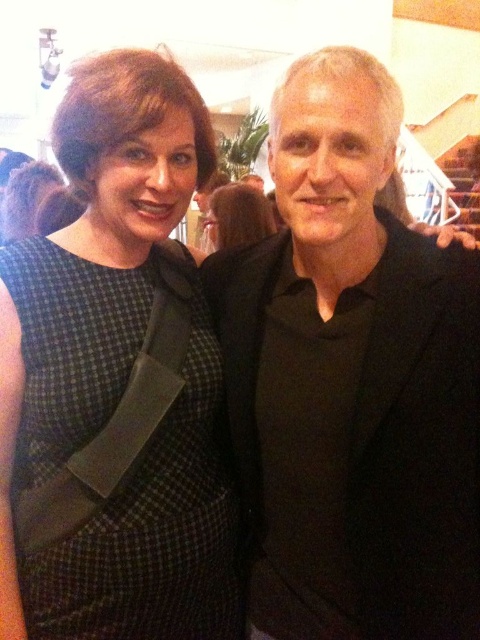
You are at a social event and see two people standing near a staircase. The woman in the green checkered dress at left and the man with dark brown hair at center are both smiling. Which person is standing more to the left?

The green checkered dress at left is positioned on the left side of dark brown hair at center, so the woman in the green checkered dress at left is standing more to the left.

You are planning to take a photo of the black matte suit at center and the green checkered dress at left. Which one should you zoom in on to capture more details without moving the camera?

The black matte suit at center is larger in size than the green checkered dress at left, so you should zoom in on the black matte suit at center to capture more details without moving the camera since it occupies a bigger area in the frame.

You are a photographer at a social event. You need to capture a photo of the black matte suit at center and dark brown hair at center. Which object should you focus on first if you want to ensure both are in focus, given that focusing on the closer object first is better? Please explain your reasoning based on their positions.

The black matte suit at center is below dark brown hair at center, so the dark brown hair at center is closer to the camera. Focus on the dark brown hair at center first to ensure both are in focus.